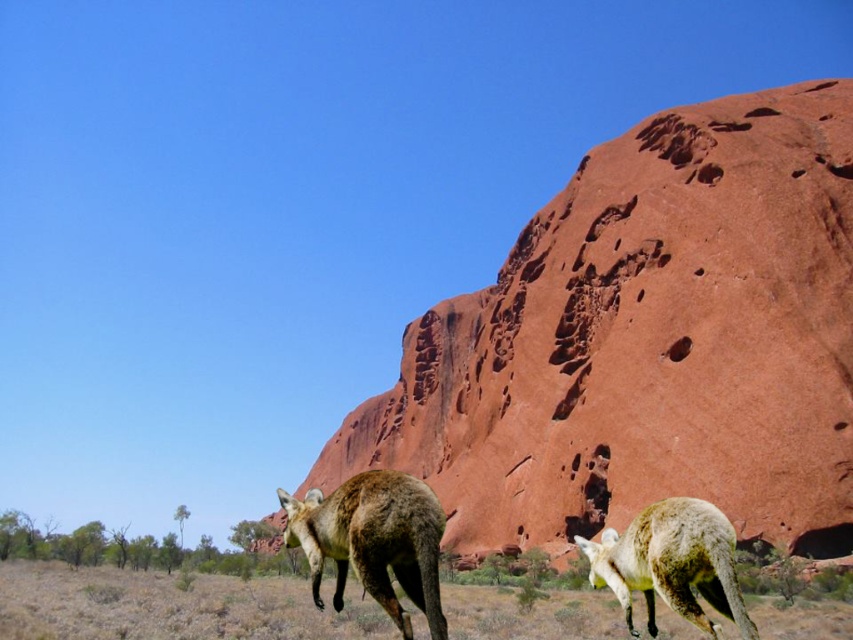
Who is taller, brown fur kangaroo at center or white fur kangaroo at lower right?

brown fur kangaroo at center is taller.

Which is below, brown fur kangaroo at center or white fur kangaroo at lower right?

brown fur kangaroo at center

Does point (384, 515) lie in front of point (648, 525)?

Yes, point (384, 515) is in front of point (648, 525).

The height and width of the screenshot is (640, 853). In order to click on brown fur kangaroo at center in this screenshot , I will do `click(373, 540)`.

Is rustic sandstone rock at center wider than white fur kangaroo at lower right?

Yes, rustic sandstone rock at center is wider than white fur kangaroo at lower right.

Does rustic sandstone rock at center appear under white fur kangaroo at lower right?

Correct, rustic sandstone rock at center is located below white fur kangaroo at lower right.

Is point (833, 355) positioned before point (689, 509)?

No, it is not.

This screenshot has width=853, height=640. Find the location of `rustic sandstone rock at center`. rustic sandstone rock at center is located at coordinates (647, 342).

Is rustic sandstone rock at center closer to the viewer compared to brown fur kangaroo at center?

No, it is not.

Is point (479, 499) farther from viewer compared to point (350, 534)?

Yes, it is.

Does point (543, 508) come in front of point (374, 483)?

That is False.

Identify the location of rustic sandstone rock at center. (647, 342).